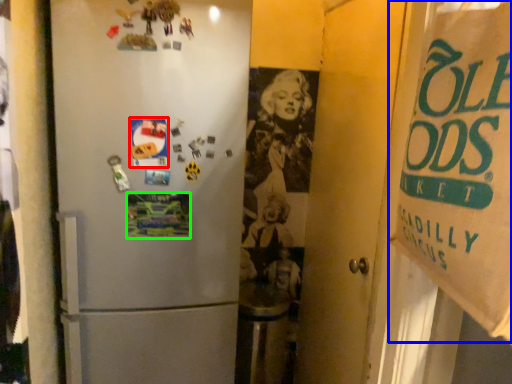
Question: Based on their relative distances, which object is nearer to postcard (highlighted by a red box)? Choose from poster (highlighted by a blue box) and postcard (highlighted by a green box).

Choices:
 (A) poster
 (B) postcard

Answer: (B)